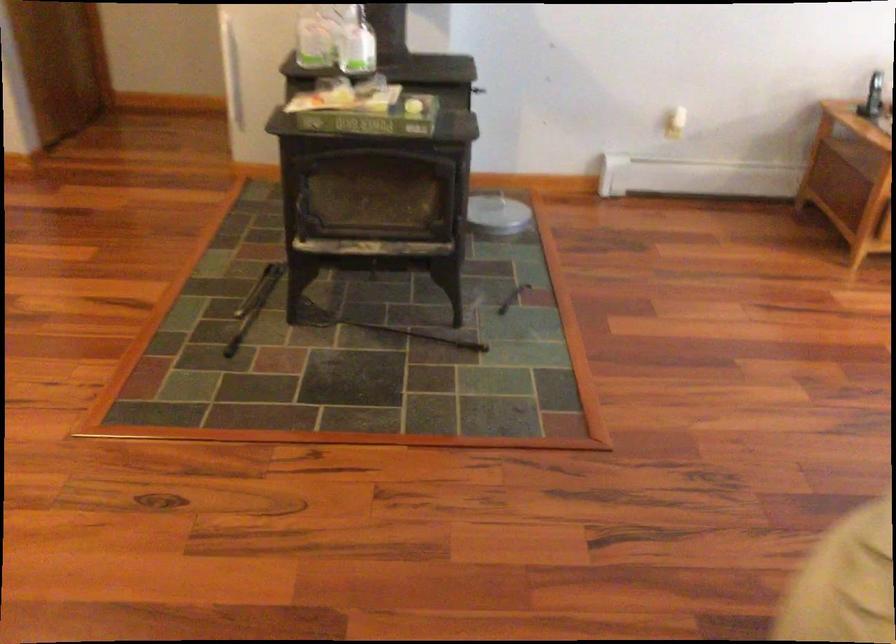
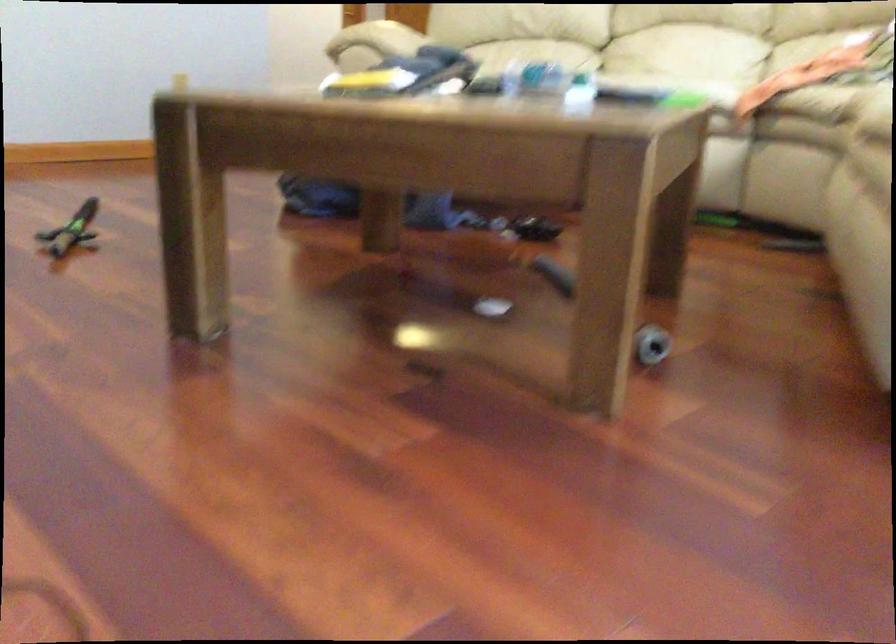
Question: I am providing you with two images of the same scene from different viewpoints. After the viewpoint changes to image2, which objects are now occluded?

Choices:
 (A) sofa sitting surface
 (B) small bottle cap
 (C) black metal poker
 (D) sofa armrest

Answer: (C)